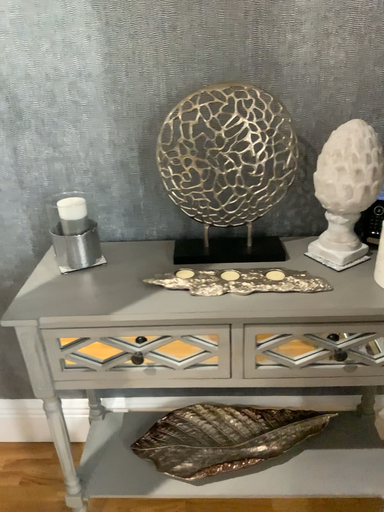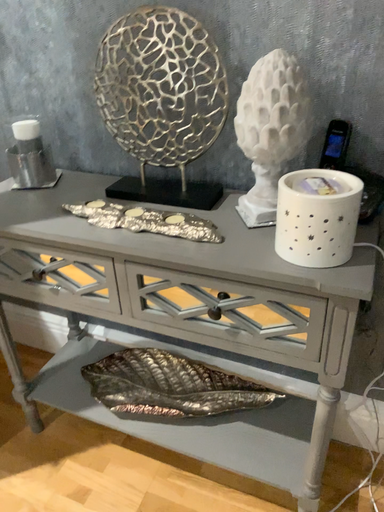
Question: Which way did the camera rotate in the video?

Choices:
 (A) rotated right
 (B) rotated left

Answer: (B)